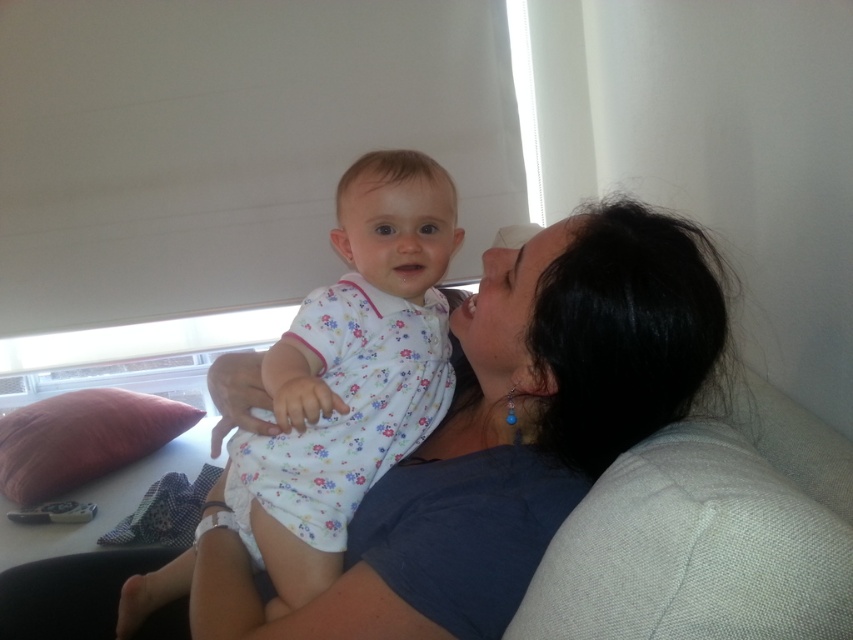
Who is positioned more to the right, white floral dress at center or pink fabric pillow at left?

white floral dress at center

Is white floral dress at center taller than pink fabric pillow at left?

Yes, white floral dress at center is taller than pink fabric pillow at left.

Locate an element on the screen. The width and height of the screenshot is (853, 640). white floral dress at center is located at coordinates (373, 310).

Does blue fabric at upper center have a lesser height compared to white floral dress at center?

Yes.

Between blue fabric at upper center and white floral dress at center, which one has less height?

blue fabric at upper center is shorter.

Which is in front, point (505, 593) or point (328, 516)?

Positioned in front is point (505, 593).

This screenshot has width=853, height=640. I want to click on blue fabric at upper center, so click(x=508, y=433).

Consider the image. Measure the distance between point (531, 486) and camera.

Point (531, 486) and camera are 31.22 inches apart from each other.

Does blue fabric at upper center appear on the right side of pink fabric pillow at left?

Indeed, blue fabric at upper center is positioned on the right side of pink fabric pillow at left.

Which is in front, point (364, 572) or point (3, 472)?

Positioned in front is point (364, 572).

Identify the location of blue fabric at upper center. (508, 433).